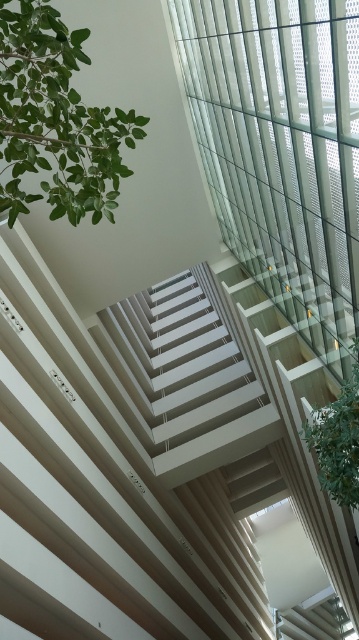
Between green leafy plant at upper left and green leafy plant at upper right, which one has more height?

green leafy plant at upper left

The height and width of the screenshot is (640, 359). Describe the element at coordinates (56, 120) in the screenshot. I see `green leafy plant at upper left` at that location.

Does point (22, 80) come farther from viewer compared to point (318, 417)?

No, (22, 80) is in front of (318, 417).

At what (x,y) coordinates should I click in order to perform the action: click on green leafy plant at upper left. Please return your answer as a coordinate pair (x, y). The image size is (359, 640). Looking at the image, I should click on (56, 120).